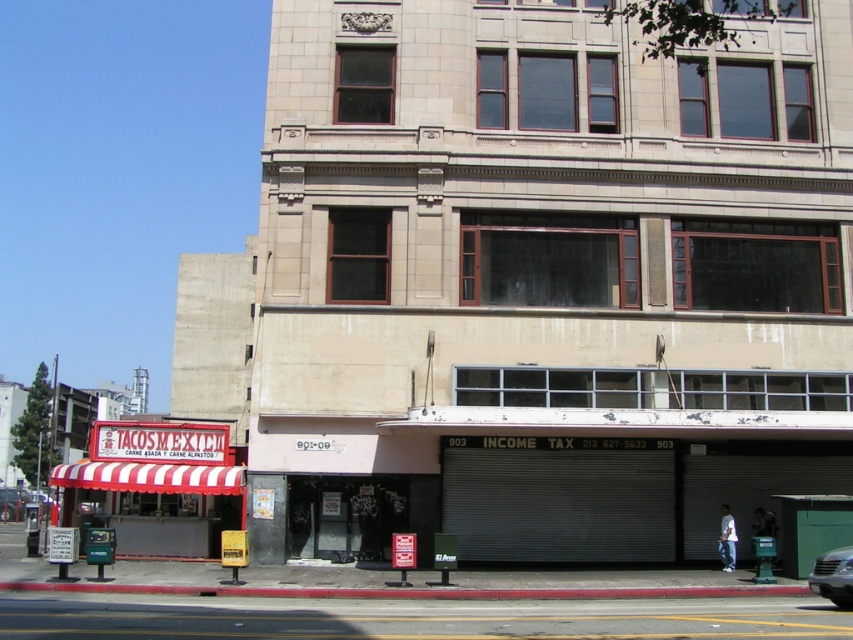
Question: Is red and white striped awning at lower left to the left of silver metallic car at lower right from the viewer's perspective?

Choices:
 (A) no
 (B) yes

Answer: (B)

Question: Can you confirm if red and white striped awning at lower left is positioned to the left of silver metallic car at lower right?

Choices:
 (A) no
 (B) yes

Answer: (B)

Question: Does red and white striped awning at lower left have a lesser width compared to silver metallic car at lower right?

Choices:
 (A) no
 (B) yes

Answer: (A)

Question: Which of the following is the farthest from the observer?

Choices:
 (A) red and white striped awning at lower left
 (B) silver metallic car at lower right

Answer: (A)